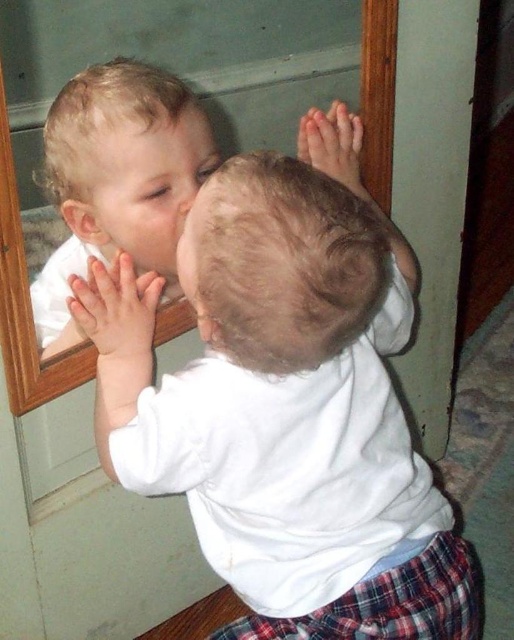
You are a photographer trying to capture the perfect shot of the white soft baby at center and the smooth white shirt at center. Since you want to ensure both are in focus, you need to know which object is larger. Can you tell me which one is bigger?

The white soft baby at center is bigger than the smooth white shirt at center, so you should focus on the white soft baby at center as it occupies more space in the frame.

You are a photographer trying to capture the child in the center of the image. The camera you are using has a focus point at coordinate point (x=286, y=401). Can you confirm if the focus point will be on the child?

Yes, the focus point at (x=286, y=401) corresponds to the white soft baby at center, so the focus point will be on the child.